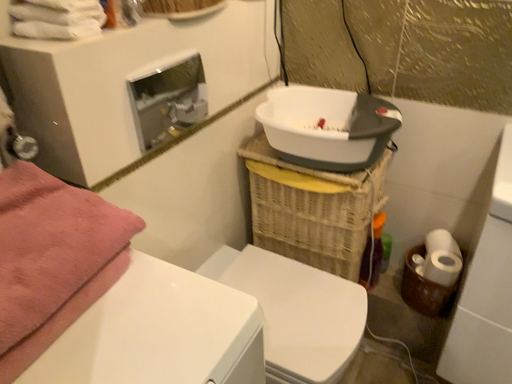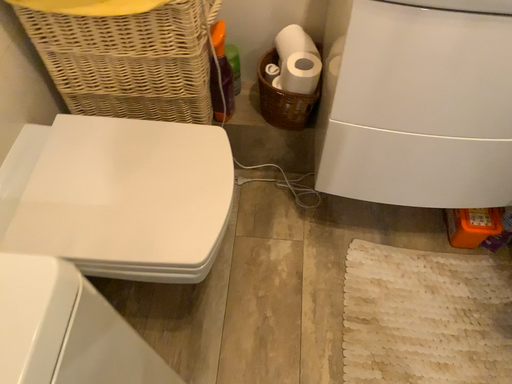
Question: Which way did the camera rotate in the video?

Choices:
 (A) rotated upward
 (B) rotated downward

Answer: (B)